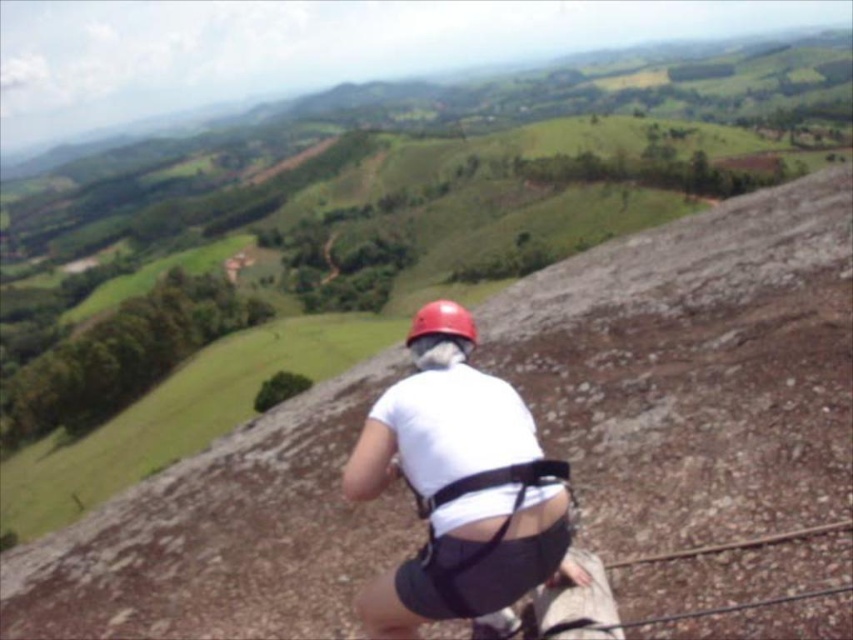
Can you confirm if white matte shirt at center is taller than matte red helmet at center?

No.

Who is lower down, white matte shirt at center or matte red helmet at center?

Positioned lower is white matte shirt at center.

Describe the element at coordinates (454, 483) in the screenshot. I see `white matte shirt at center` at that location.

Where is `white matte shirt at center`? white matte shirt at center is located at coordinates (454, 483).